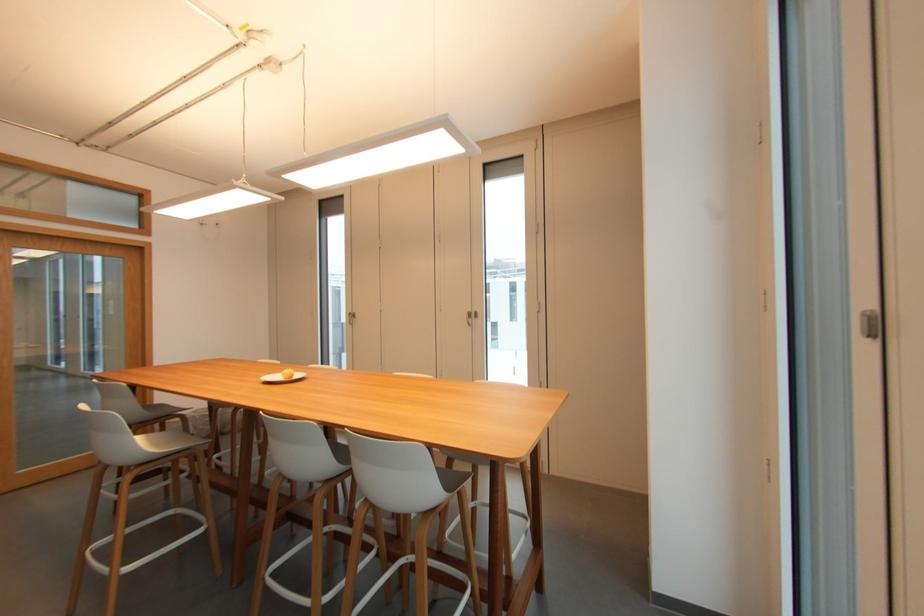
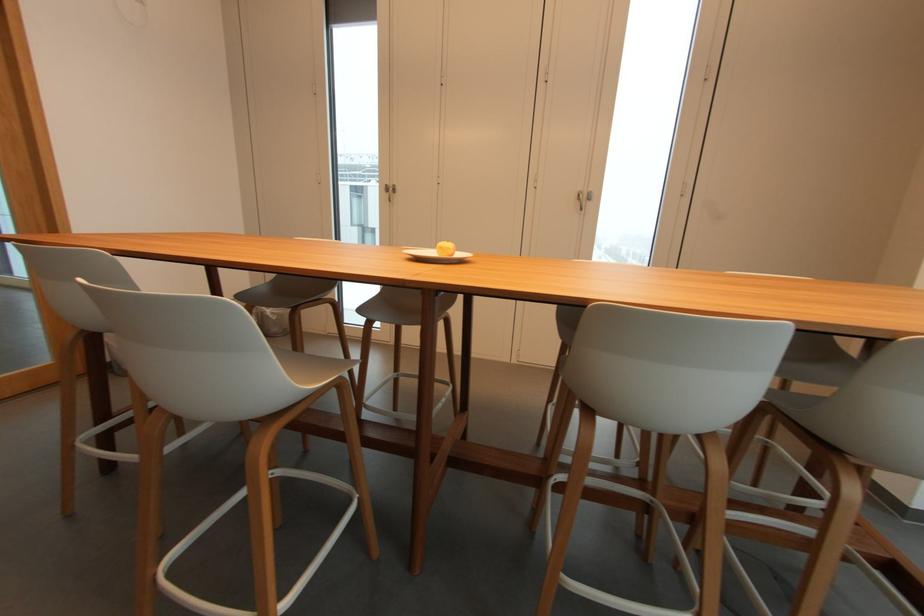
Consider the image. Which direction would the cameraman need to move to produce the second image?

The movement direction of the cameraman is left, forward.